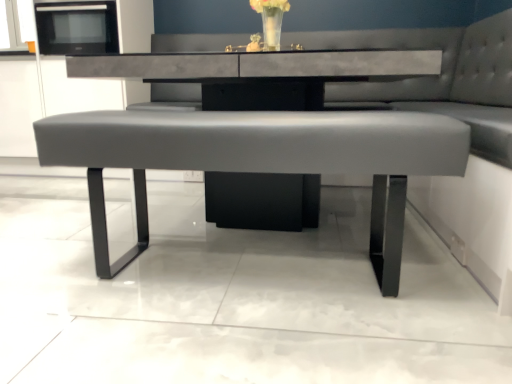
Question: From a real-world perspective, is matte gray bench at center positioned above or below translucent glass vase at upper center?

Choices:
 (A) above
 (B) below

Answer: (B)

Question: In terms of width, does matte gray bench at center look wider or thinner when compared to translucent glass vase at upper center?

Choices:
 (A) thin
 (B) wide

Answer: (B)

Question: Which object is positioned closest to the translucent glass vase at upper center?

Choices:
 (A) matte gray bench at center
 (B) black matte microwave at upper left
 (C) matte gray bench at center

Answer: (C)

Question: Estimate the real-world distances between objects in this image. Which object is closer to the matte gray bench at center?

Choices:
 (A) matte gray bench at center
 (B) translucent glass vase at upper center
 (C) black matte microwave at upper left

Answer: (A)